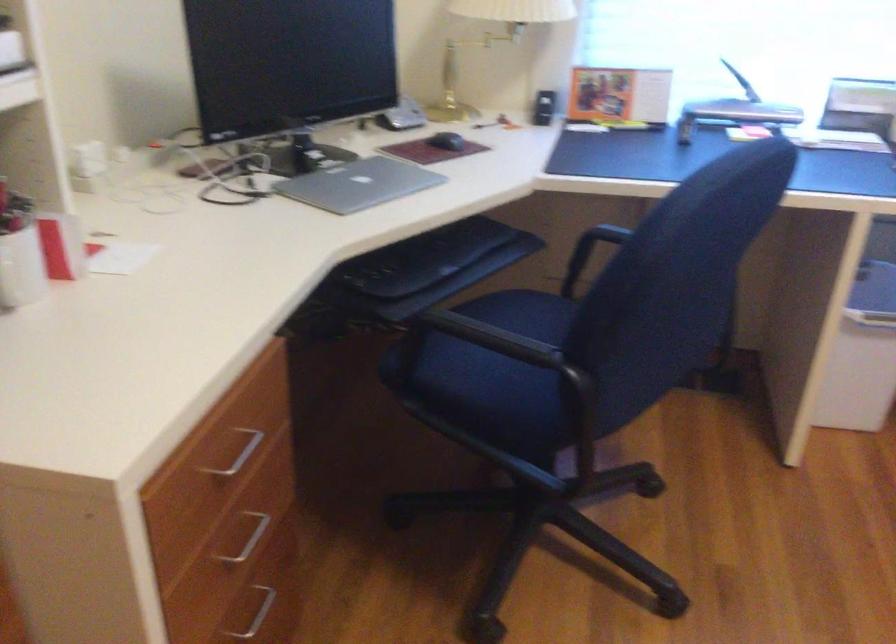
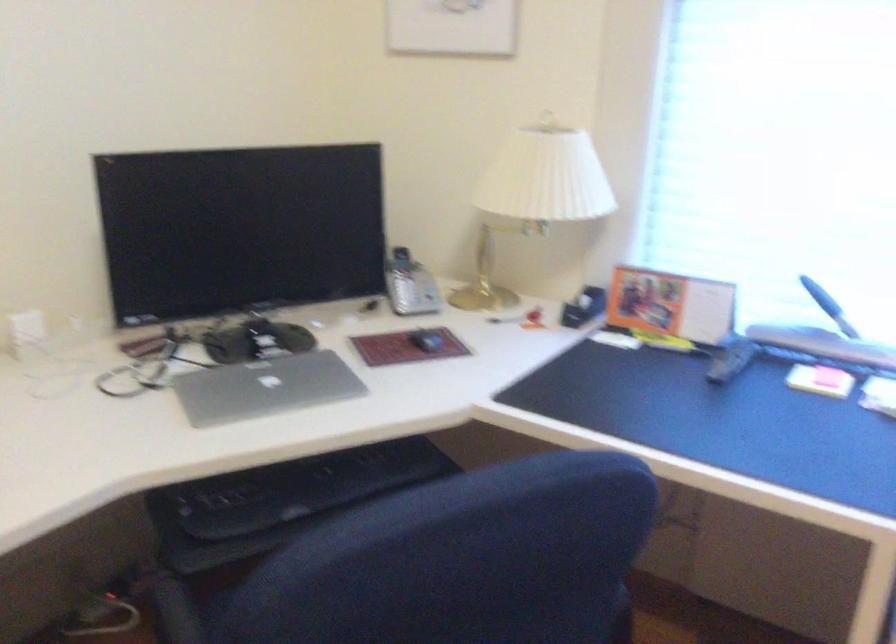
Find the pixel in the second image that matches [452,140] in the first image.

(426, 341)